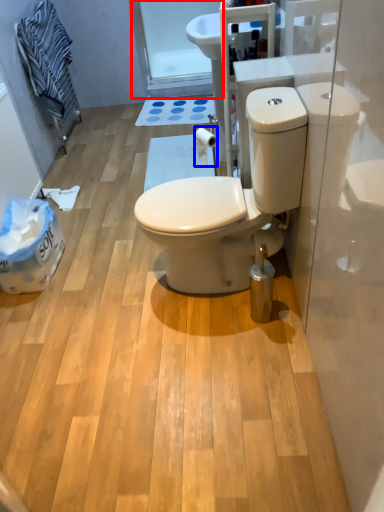
Question: Which object is closer to the camera taking this photo, glass door (highlighted by a red box) or toilet paper (highlighted by a blue box)?

Choices:
 (A) glass door
 (B) toilet paper

Answer: (B)